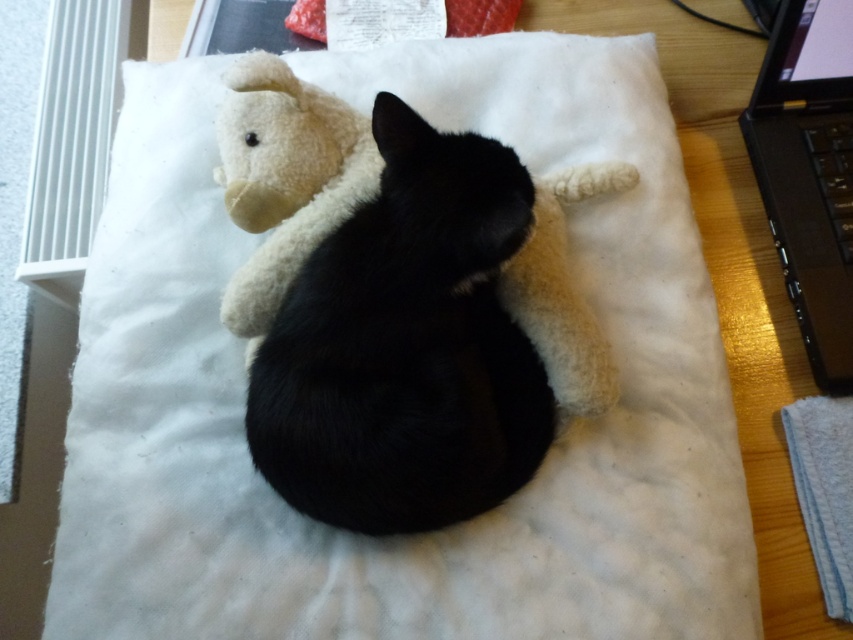
You are trying to decide whether to place a new small toy on the table next to the black fur cat at center and the black plastic laptop at right. Given their sizes, which object would require more space on the table?

The black fur cat at center requires more space on the table because it is bigger than the black plastic laptop at right.

You are trying to determine if the black fur cat at center can fit under a table that currently has the black plastic laptop at right placed on it. Based on their heights, can the cat comfortably pass underneath without bending?

The black fur cat at center is not as tall as the black plastic laptop at right, so the cat can comfortably pass under the table since its height is lower than the laptop placed on it.

You are a photographer standing in front of a wooden table with a black fur cat at center. You want to take a closeup photo of the cat without moving it. Based on the scene, what is the minimum distance you should set your camera lens to focus on?

The black fur cat at center is 27.13 inches away from the viewer, so the camera lens should be set to a minimum focusing distance of at least 27.13 inches to capture the cat clearly without moving it.